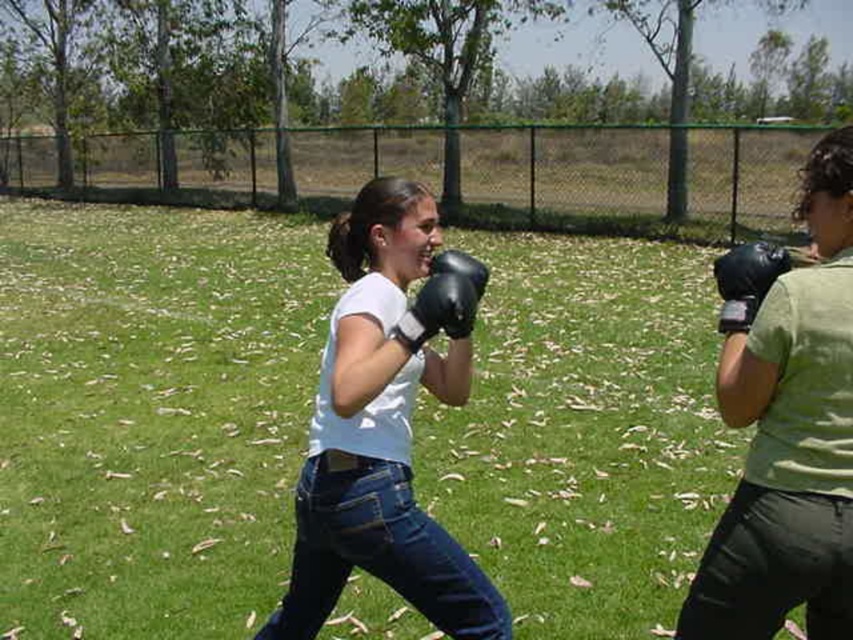
Can you confirm if matte black boxing glove at right is positioned above black synthetic glove at right?

No, matte black boxing glove at right is not above black synthetic glove at right.

Describe the element at coordinates (786, 426) in the screenshot. The width and height of the screenshot is (853, 640). I see `matte black boxing glove at right` at that location.

The image size is (853, 640). Find the location of `matte black boxing glove at right`. matte black boxing glove at right is located at coordinates (786, 426).

You are a GUI agent. You are given a task and a screenshot of the screen. Output one action in this format:
    pyautogui.click(x=<x>, y=<y>)
    Task: Click on the green grass at center
    
    Given the screenshot: What is the action you would take?
    pyautogui.click(x=151, y=416)

Is point (9, 253) positioned before point (450, 625)?

That is False.

Where is `green grass at center`? green grass at center is located at coordinates (151, 416).

Does green grass at center lie in front of matte black boxing glove at right?

No, green grass at center is further to the viewer.

Does green grass at center have a greater width compared to matte black boxing glove at right?

Indeed, green grass at center has a greater width compared to matte black boxing glove at right.

Who is more distant from viewer, [666,481] or [762,342]?

Positioned behind is point [666,481].

Identify the location of green grass at center. (151, 416).